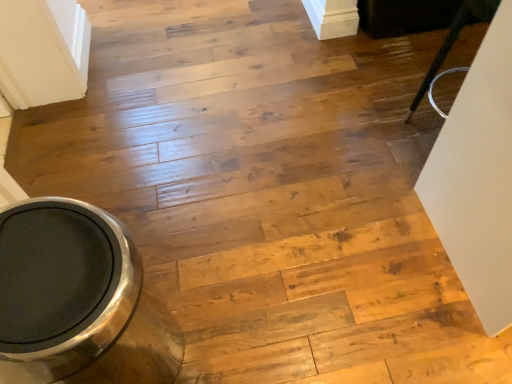
Question: From a real-world perspective, does polished stainless steel toilet bowl at lower left sit lower than black glossy chair at upper right?

Choices:
 (A) no
 (B) yes

Answer: (B)

Question: Considering the relative sizes of polished stainless steel toilet bowl at lower left and black glossy chair at upper right in the image provided, is polished stainless steel toilet bowl at lower left bigger than black glossy chair at upper right?

Choices:
 (A) no
 (B) yes

Answer: (B)

Question: Is polished stainless steel toilet bowl at lower left at the right side of black glossy chair at upper right?

Choices:
 (A) yes
 (B) no

Answer: (B)

Question: Is polished stainless steel toilet bowl at lower left wider than black glossy chair at upper right?

Choices:
 (A) yes
 (B) no

Answer: (A)

Question: Is polished stainless steel toilet bowl at lower left behind black glossy chair at upper right?

Choices:
 (A) no
 (B) yes

Answer: (A)

Question: Is black glossy chair at upper right located within polished stainless steel toilet bowl at lower left?

Choices:
 (A) no
 (B) yes

Answer: (A)

Question: Is the position of black glossy chair at upper right more distant than that of polished stainless steel toilet bowl at lower left?

Choices:
 (A) yes
 (B) no

Answer: (A)

Question: Is black glossy chair at upper right at the right side of polished stainless steel toilet bowl at lower left?

Choices:
 (A) yes
 (B) no

Answer: (A)

Question: Can you confirm if black glossy chair at upper right is taller than polished stainless steel toilet bowl at lower left?

Choices:
 (A) yes
 (B) no

Answer: (B)

Question: Is black glossy chair at upper right oriented away from polished stainless steel toilet bowl at lower left?

Choices:
 (A) yes
 (B) no

Answer: (B)

Question: From a real-world perspective, is black glossy chair at upper right positioned under polished stainless steel toilet bowl at lower left based on gravity?

Choices:
 (A) yes
 (B) no

Answer: (B)

Question: Is black glossy chair at upper right oriented towards polished stainless steel toilet bowl at lower left?

Choices:
 (A) yes
 (B) no

Answer: (B)

Question: Is polished stainless steel toilet bowl at lower left in front of or behind black glossy chair at upper right in the image?

Choices:
 (A) behind
 (B) front

Answer: (B)